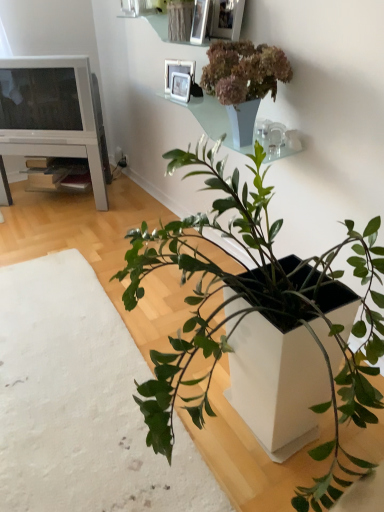
Question: In terms of size, does green matte plant at center, acting as the 1th houseplant starting from the left, appear bigger or smaller than white wood entertainment center at left?

Choices:
 (A) big
 (B) small

Answer: (A)

Question: Is green matte plant at center, acting as the 1th houseplant starting from the left, in front of or behind white wood entertainment center at left in the image?

Choices:
 (A) front
 (B) behind

Answer: (A)

Question: Which object is positioned closest to the metallic silver picture frame at upper center, the fourth picture frame in the back-to-front sequence?

Choices:
 (A) matte white television at upper left
 (B) metallic silver picture frame at upper center, marked as the second picture frame in a back-to-front arrangement
 (C) metallic silver picture frame at upper center, placed as the 3th picture frame when sorted from back to front
 (D) green matte plant at center, which is counted as the 2th houseplant, starting from the right
 (E) translucent glass shelf at upper center

Answer: (C)

Question: Estimate the real-world distances between objects in this image. Which object is farther from the metallic silver picture frame at upper center, which appears as the second picture frame when viewed from the front?

Choices:
 (A) white glossy picture frame at upper center, which is the 1th picture frame in back-to-front order
 (B) translucent glass shelf at upper center
 (C) white wood entertainment center at left
 (D) matte white television at upper left
 (E) green matte plant at lower right

Answer: (E)